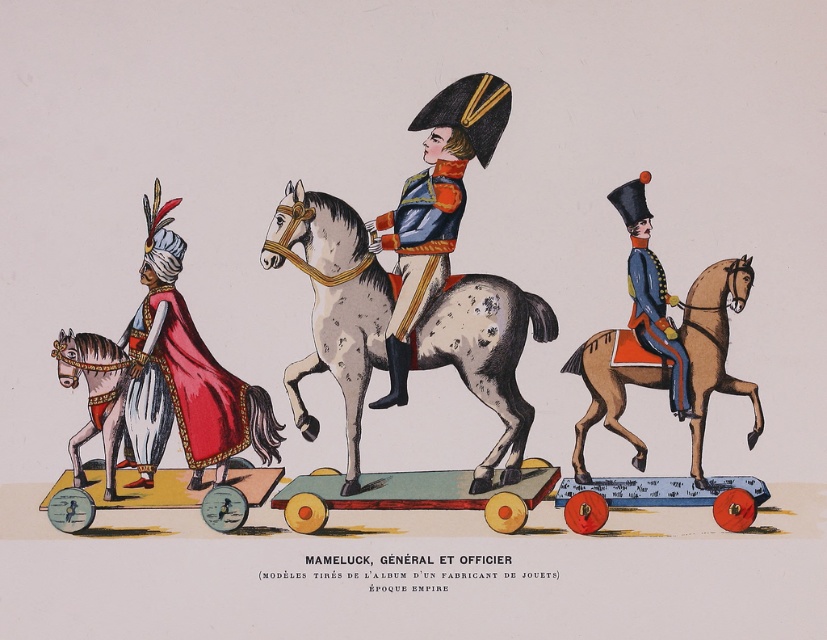
You are a child trying to find the shiny blue uniform at center and the brown leather horse at right in the image. Which one is higher up?

The shiny blue uniform at center is located above the brown leather horse at right, so it is higher up.